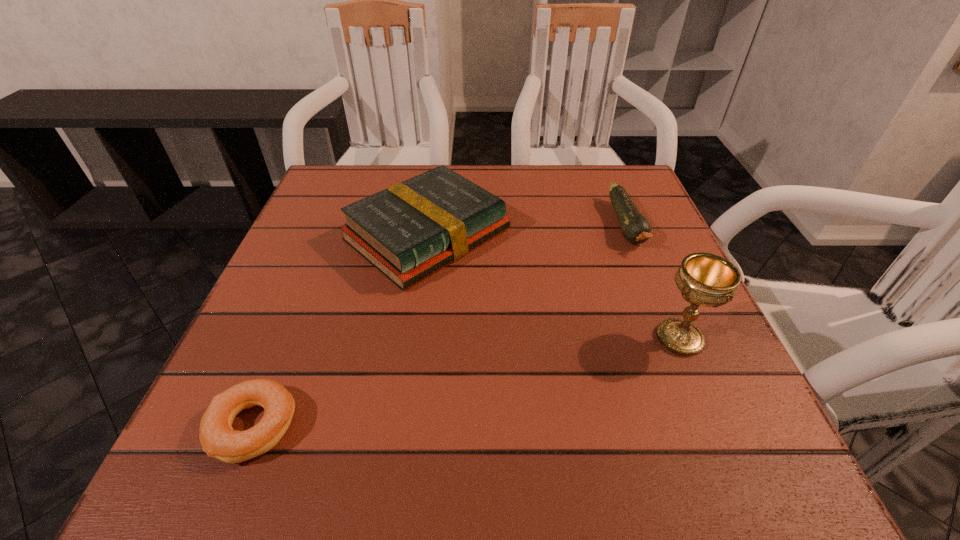
Locate an element on the screen. The image size is (960, 540). unoccupied position between the bagel and the second shortest object is located at coordinates (440, 325).

Where is `empty space that is in between the bagel and the tallest object`? empty space that is in between the bagel and the tallest object is located at coordinates (467, 382).

This screenshot has width=960, height=540. What are the coordinates of `free space between the zucchini and the third farthest object` in the screenshot? It's located at (653, 281).

The width and height of the screenshot is (960, 540). I want to click on vacant point located between the hardback book and the zucchini, so click(x=527, y=230).

Find the location of a particular element. This screenshot has width=960, height=540. vacant region between the chalice and the second shortest object is located at coordinates (653, 281).

I want to click on vacant space that is in between the nearest object and the hardback book, so click(x=340, y=330).

The image size is (960, 540). In order to click on empty space between the third tallest object and the bagel in this screenshot , I will do `click(440, 325)`.

You are a GUI agent. You are given a task and a screenshot of the screen. Output one action in this format:
    pyautogui.click(x=<x>, y=<y>)
    Task: Click on the unoccupied area between the nearest object and the second tallest object
    The image size is (960, 540).
    Given the screenshot: What is the action you would take?
    pyautogui.click(x=340, y=330)

The image size is (960, 540). Identify the location of object identified as the closest to the tallest object. (635, 228).

Locate an element on the screen. The image size is (960, 540). object that is the closest to the second tallest object is located at coordinates (219, 440).